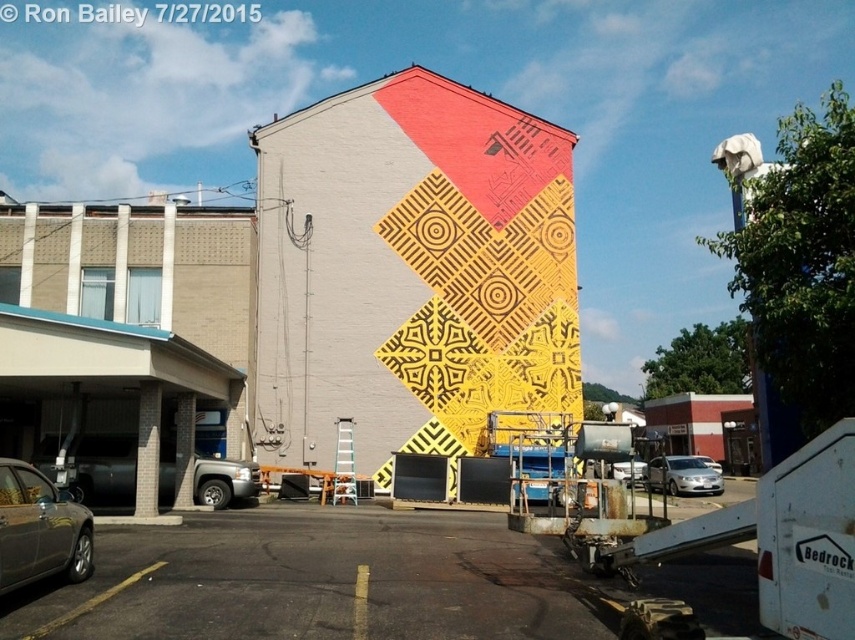
Question: Which of the following is the closest to the observer?

Choices:
 (A) metallic silver truck at left
 (B) yellow matte geometric pattern at center
 (C) silver metallic sedan at lower right
 (D) metallic gray sedan at lower left

Answer: (D)

Question: Is metallic gray sedan at lower left further to camera compared to silver metallic sedan at lower right?

Choices:
 (A) yes
 (B) no

Answer: (B)

Question: Based on their relative distances, which object is farther from the metallic silver truck at left?

Choices:
 (A) metallic gray sedan at lower left
 (B) silver metallic sedan at lower right

Answer: (B)

Question: Can you confirm if metallic gray sedan at lower left is thinner than silver metallic sedan at lower right?

Choices:
 (A) yes
 (B) no

Answer: (A)

Question: Is yellow matte geometric pattern at center to the right of silver metallic sedan at center from the viewer's perspective?

Choices:
 (A) no
 (B) yes

Answer: (A)

Question: Which is nearer to the yellow matte geometric pattern at center?

Choices:
 (A) silver metallic sedan at center
 (B) metallic gray sedan at lower left
 (C) metallic silver truck at left
 (D) silver metallic car at center

Answer: (C)